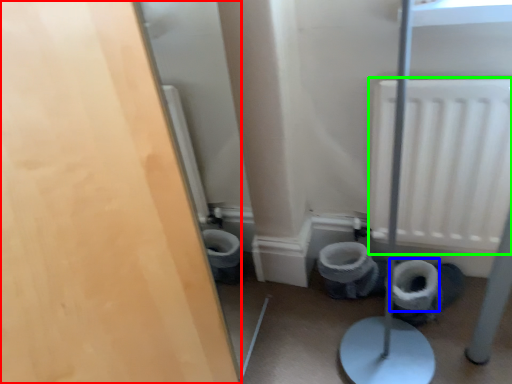
Question: Estimate the real-world distances between objects in this image. Which object is farther from door (highlighted by a red box), toilet paper (highlighted by a blue box) or radiator (highlighted by a green box)?

Choices:
 (A) toilet paper
 (B) radiator

Answer: (A)